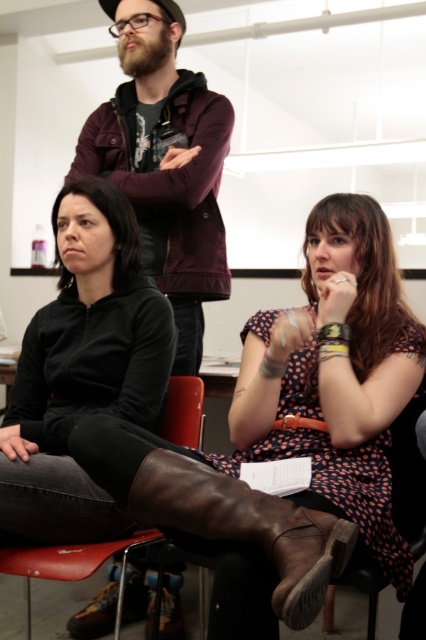
Question: Which point is farther from the camera taking this photo?

Choices:
 (A) (296, 524)
 (B) (124, 547)
 (C) (206, 227)

Answer: (C)

Question: Which of the following is the farthest from the observer?

Choices:
 (A) leather chair at lower center
 (B) brown leather chair at lower right

Answer: (A)

Question: Is brown leather boot at lower center to the right of brown leather chair at lower right from the viewer's perspective?

Choices:
 (A) no
 (B) yes

Answer: (A)

Question: Does brown leather boot at lower center come in front of leather chair at lower center?

Choices:
 (A) yes
 (B) no

Answer: (A)

Question: Where is brown leather boot at lower center located in relation to leather chair at lower center in the image?

Choices:
 (A) right
 (B) left

Answer: (A)

Question: Estimate the real-world distances between objects in this image. Which object is farther from the brown leather boot at lower center?

Choices:
 (A) brown leather chair at lower right
 (B) leather chair at lower center

Answer: (B)